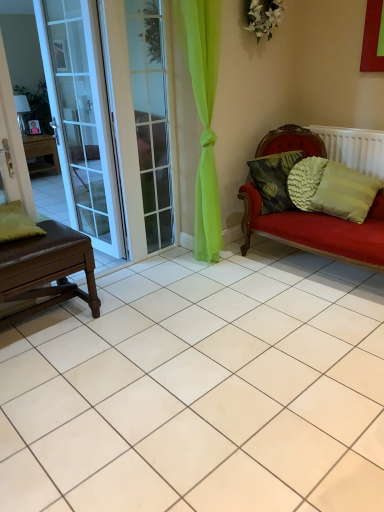
Question: Relative to green matte pillow at left, the fourth pillow in the right-to-left sequence, is white plastic radiator at right in front or behind?

Choices:
 (A) behind
 (B) front

Answer: (A)

Question: From their relative heights in the image, would you say white plastic radiator at right is taller or shorter than green matte pillow at left, placed as the first pillow when sorted from left to right?

Choices:
 (A) short
 (B) tall

Answer: (B)

Question: Which object is positioned farthest from the white glass door at left?

Choices:
 (A) textured green pillow at right, which is counted as the 2th pillow, starting from the left
 (B) textured green pillow at right, which is counted as the 2th pillow, starting from the right
 (C) clear glass screen door at left
 (D) green textured pillow at right, positioned as the 4th pillow in left-to-right order
 (E) green matte pillow at left, the fourth pillow in the right-to-left sequence

Answer: (D)

Question: Considering the real-world distances, which object is farthest from the green matte pillow at left, the fourth pillow in the right-to-left sequence?

Choices:
 (A) textured green pillow at right, the third pillow when ordered from left to right
 (B) green textured pillow at right, positioned as the 4th pillow in left-to-right order
 (C) clear glass screen door at left
 (D) white plastic radiator at right
 (E) brown leather table at left

Answer: (D)